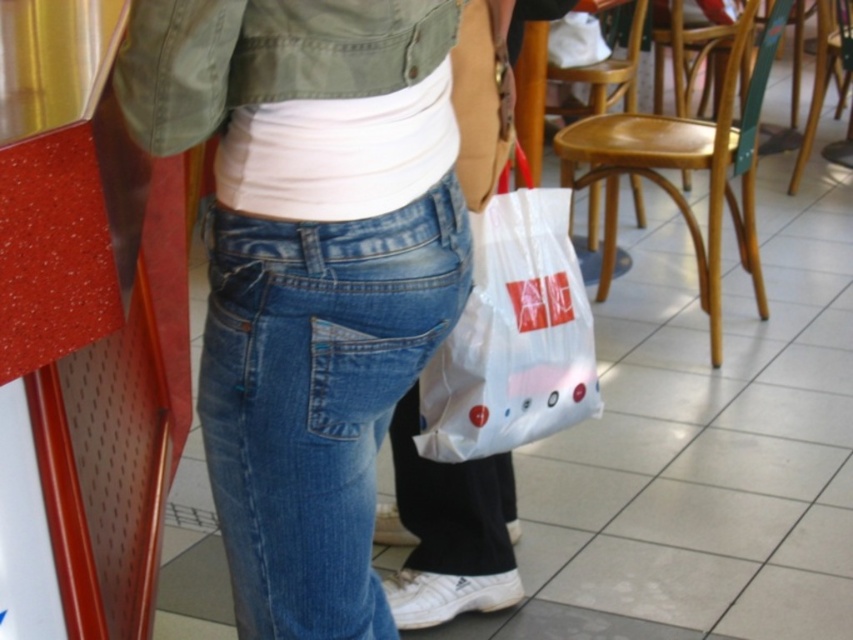
Can you confirm if blue denim jeans at center is positioned to the right of white plastic bag at center?

Incorrect, blue denim jeans at center is not on the right side of white plastic bag at center.

Can you confirm if blue denim jeans at center is smaller than white plastic bag at center?

Indeed, blue denim jeans at center has a smaller size compared to white plastic bag at center.

I want to click on blue denim jeans at center, so click(x=316, y=397).